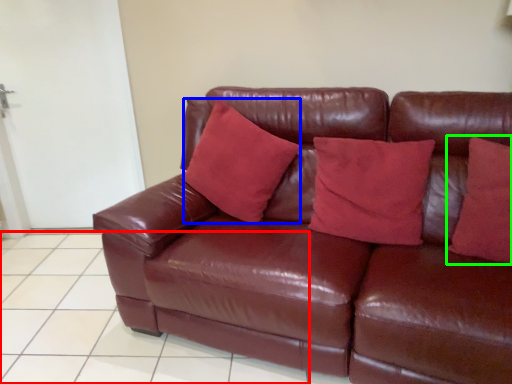
Question: Based on their relative distances, which object is farther from tile (highlighted by a red box)? Choose from pillow (highlighted by a blue box) and pillow (highlighted by a green box).

Choices:
 (A) pillow
 (B) pillow

Answer: (B)